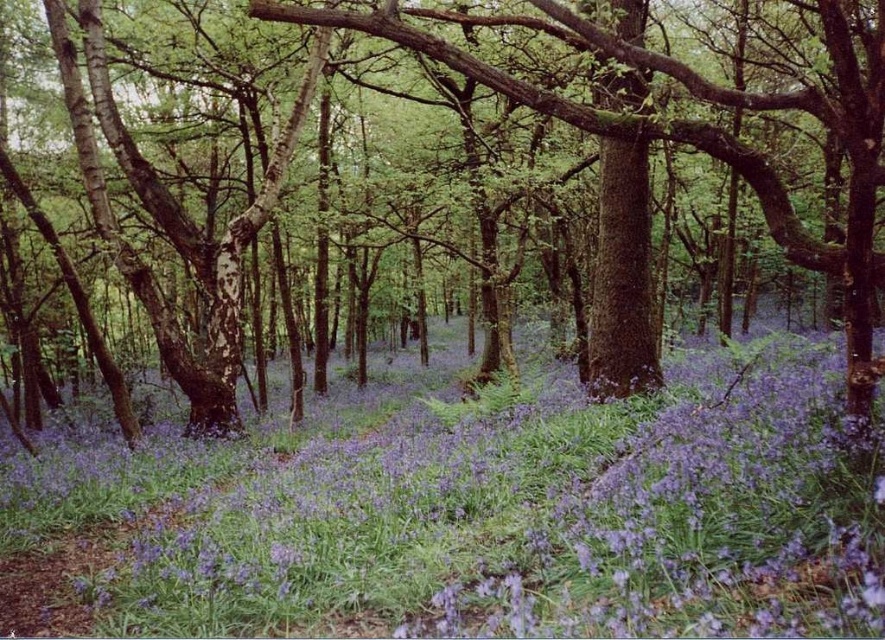
Question: Is purple matte flower at center bigger than green matte tree at center?

Choices:
 (A) no
 (B) yes

Answer: (A)

Question: Is purple matte flower at center wider than green matte tree at center?

Choices:
 (A) yes
 (B) no

Answer: (A)

Question: Among these points, which one is farthest from the camera?

Choices:
 (A) pyautogui.click(x=760, y=566)
 (B) pyautogui.click(x=633, y=326)

Answer: (B)

Question: Which point is closer to the camera?

Choices:
 (A) (582, 124)
 (B) (326, 465)

Answer: (A)

Question: Does purple matte flower at center appear on the left side of green matte tree at center?

Choices:
 (A) no
 (B) yes

Answer: (A)